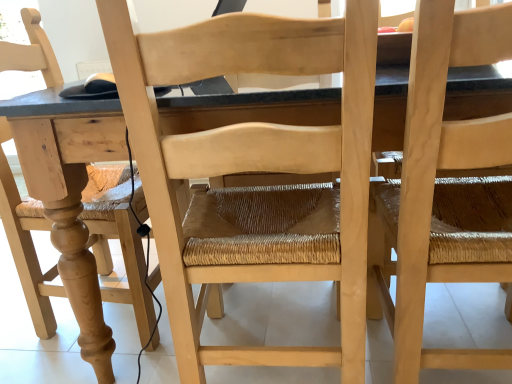
Question: In terms of height, does natural wood chair at center, the first chair viewed from the left, look taller or shorter compared to natural wood table at center?

Choices:
 (A) short
 (B) tall

Answer: (B)

Question: Choose the correct answer: Is natural wood chair at center, the first chair viewed from the left, inside natural wood table at center or outside it?

Choices:
 (A) inside
 (B) outside

Answer: (A)

Question: Which is farther from the natural wood chair at right, which is counted as the 2th chair, starting from the left?

Choices:
 (A) natural wood table at center
 (B) natural wood chair at center, the first chair viewed from the left

Answer: (A)

Question: Which is farther from the natural wood table at center?

Choices:
 (A) natural wood chair at right, positioned as the first chair in right-to-left order
 (B) natural wood chair at center, the first chair viewed from the left

Answer: (A)